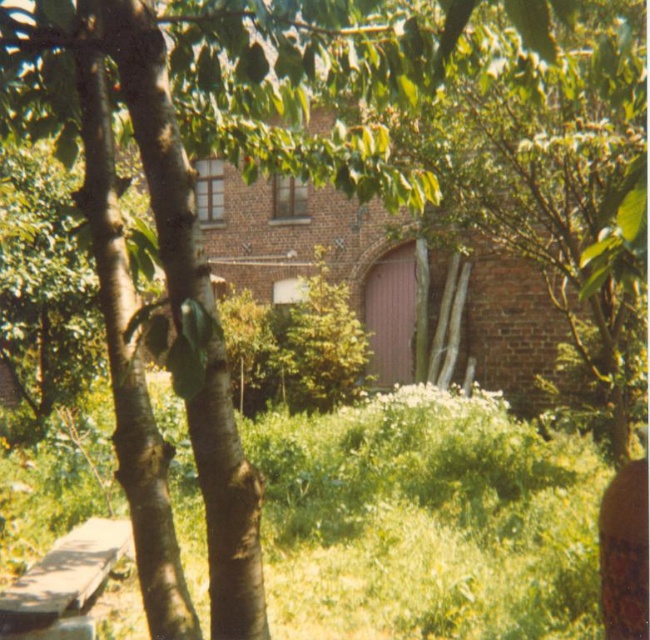
Who is higher up, green grass at center or brown leather bottle at lower right?

Positioned higher is brown leather bottle at lower right.

Does point (488, 541) come closer to viewer compared to point (642, 614)?

That is False.

Between point (370, 595) and point (645, 566), which one is positioned in front?

Point (645, 566) is more forward.

Where is `green grass at center`? The image size is (650, 640). green grass at center is located at coordinates (426, 522).